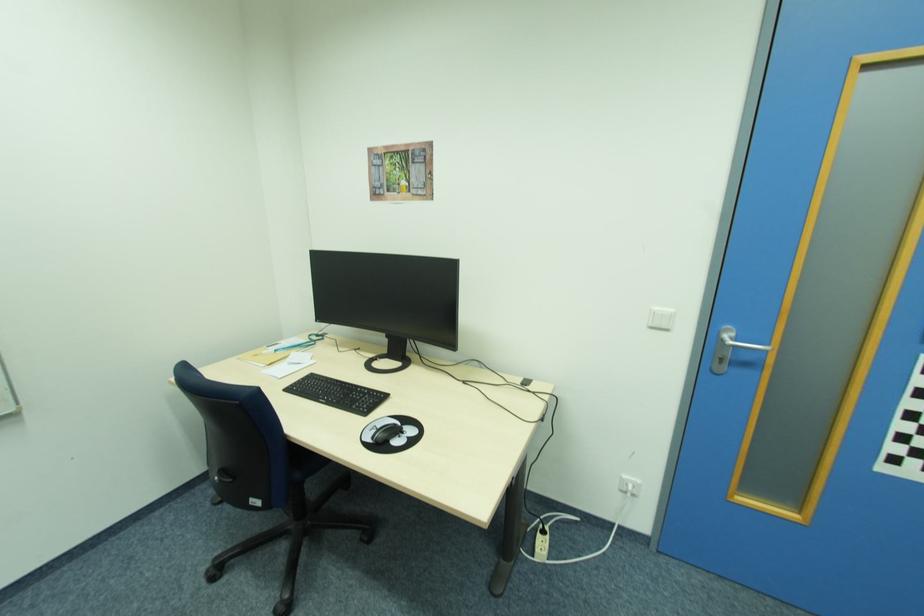
Identify the location of white light switch. (661, 318).